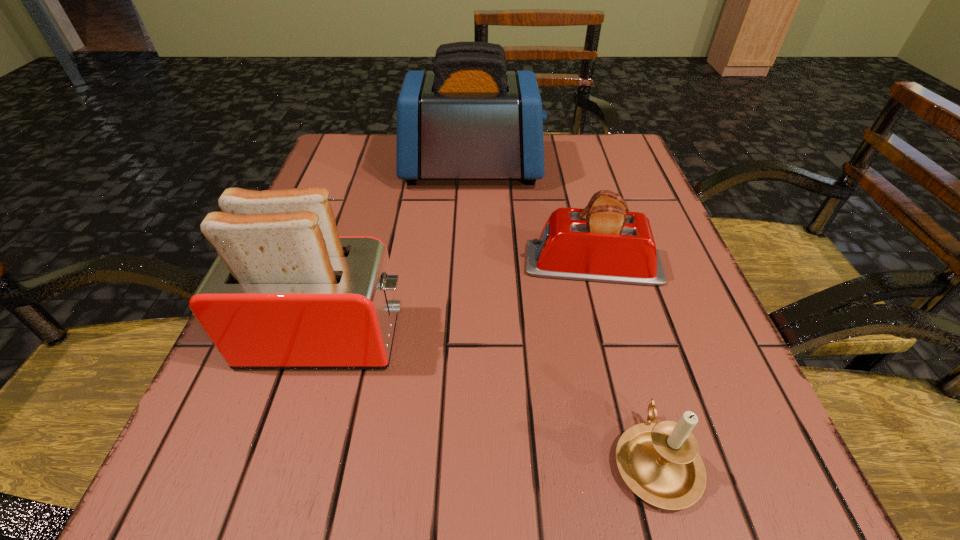
Find the location of `vacant space at the far left corner of the desktop`. vacant space at the far left corner of the desktop is located at coordinates (360, 174).

Locate an element on the screen. This screenshot has height=540, width=960. blank space at the far right corner of the desktop is located at coordinates click(632, 169).

In the image, there is a desktop. Identify the location of blank space at the near right corner. This screenshot has height=540, width=960. (745, 465).

The width and height of the screenshot is (960, 540). I want to click on free space that is in between the farthest toaster and the second nearest toaster, so click(533, 217).

At what (x,y) coordinates should I click in order to perform the action: click on free space between the nearest object and the third farthest object. Please return your answer as a coordinate pair (x, y). Looking at the image, I should click on (491, 399).

The height and width of the screenshot is (540, 960). I want to click on empty location between the farthest object and the second nearest object, so click(x=399, y=254).

At what (x,y) coordinates should I click in order to perform the action: click on free space that is in between the candle holder and the second farthest object. Please return your answer as a coordinate pair (x, y). This screenshot has height=540, width=960. Looking at the image, I should click on (624, 362).

Find the location of a particular element. The height and width of the screenshot is (540, 960). blank region between the candle holder and the nearest toaster is located at coordinates (x=491, y=399).

Locate an element on the screen. The height and width of the screenshot is (540, 960). vacant area between the shortest toaster and the farthest object is located at coordinates (533, 217).

This screenshot has width=960, height=540. What are the coordinates of `vacant region between the farthest toaster and the candle holder` in the screenshot? It's located at (564, 314).